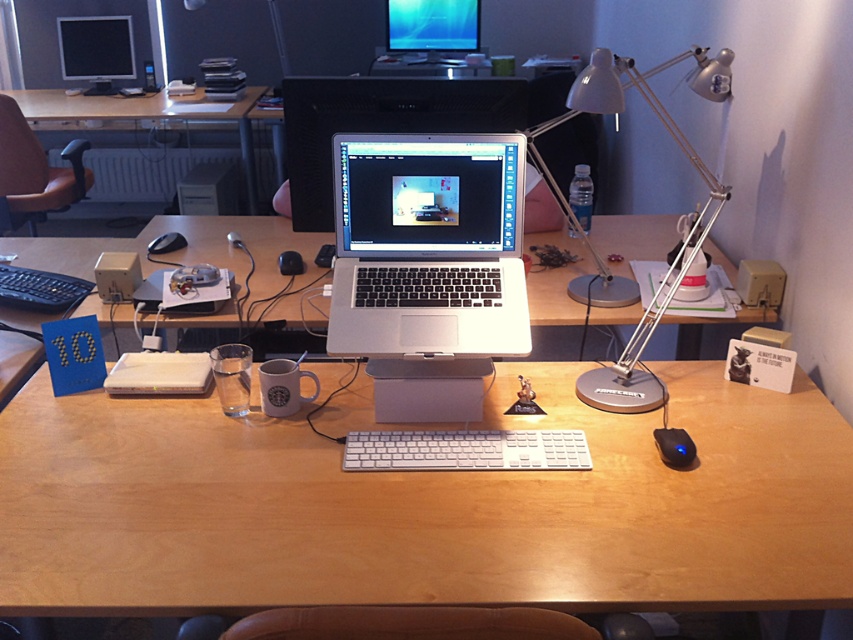
Describe the element at coordinates (422, 508) in the screenshot. I see `wooden desk at center` at that location.

This screenshot has width=853, height=640. I want to click on wooden desk at center, so click(x=422, y=508).

Identify the location of wooden desk at center. Image resolution: width=853 pixels, height=640 pixels. (422, 508).

Is wooden desk at center positioned before white plastic keyboard at center?

Yes, it is.

Does wooden desk at center have a lesser height compared to white plastic keyboard at center?

Incorrect, wooden desk at center's height does not fall short of white plastic keyboard at center's.

Which is behind, point (602, 454) or point (463, 467)?

Point (602, 454)

Where is `wooden desk at center`? The image size is (853, 640). wooden desk at center is located at coordinates (422, 508).

Is silver metallic laptop at center below black plastic mouse at center?

Indeed, silver metallic laptop at center is positioned under black plastic mouse at center.

The image size is (853, 640). In order to click on silver metallic laptop at center in this screenshot , I will do `click(428, 244)`.